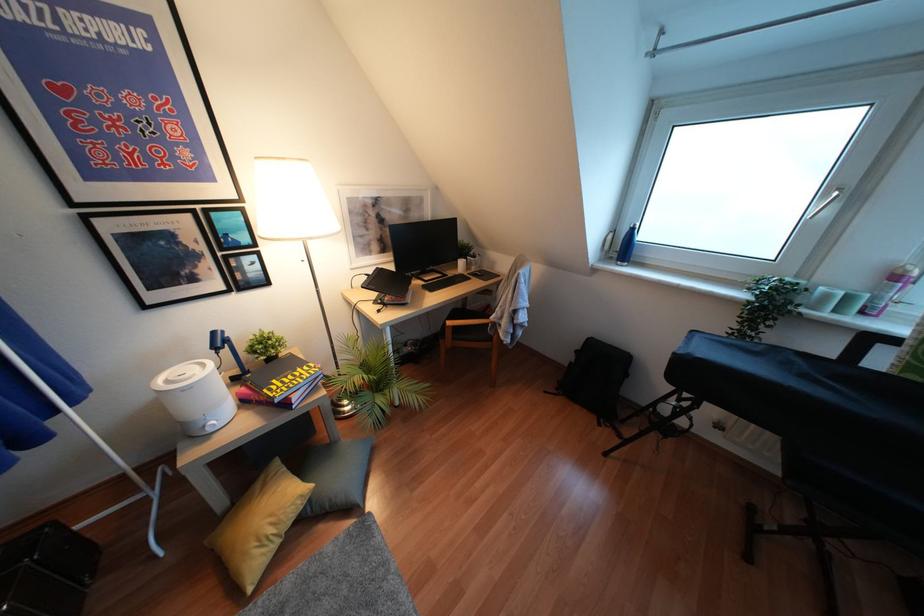
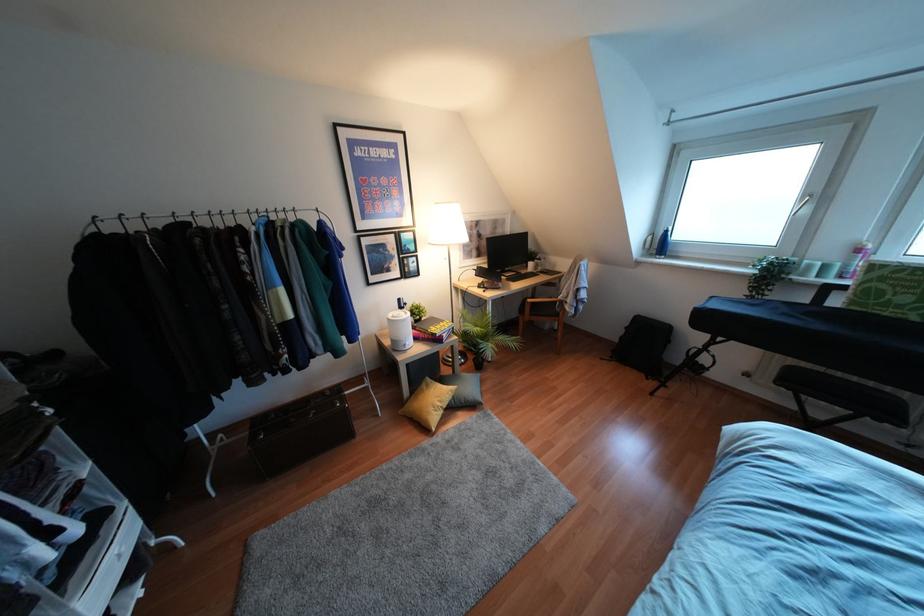
In the second image, find the point that corresponds to [210,430] in the first image.

(407, 347)